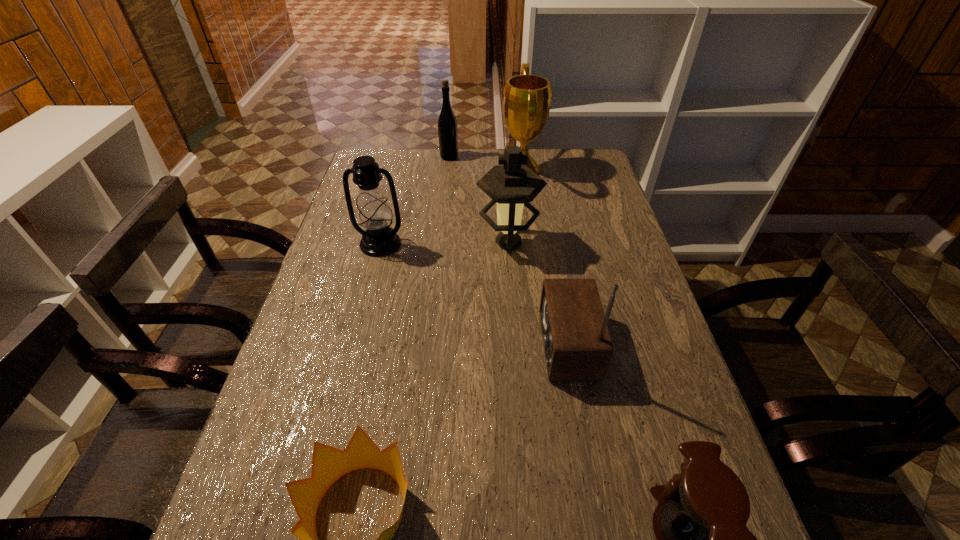
This screenshot has height=540, width=960. Identify the location of vacant point at the far left corner. [x=385, y=153].

Where is `free space between the fifth farthest object and the award`? The image size is (960, 540). free space between the fifth farthest object and the award is located at coordinates tap(544, 257).

Where is `free spot between the right oil lamp and the left oil lamp`? The height and width of the screenshot is (540, 960). free spot between the right oil lamp and the left oil lamp is located at coordinates (444, 243).

Locate an element on the screen. This screenshot has width=960, height=540. unoccupied position between the beer bottle and the left oil lamp is located at coordinates (415, 200).

Locate which object is the fourth closest to the award. Please provide its 2D coordinates. Your answer should be formatted as a tuple, i.e. [(x, y)], where the tuple contains the x and y coordinates of a point satisfying the conditions above.

[(577, 344)]

Locate an element on the screen. object that stands as the closest to the right oil lamp is located at coordinates pyautogui.click(x=527, y=98).